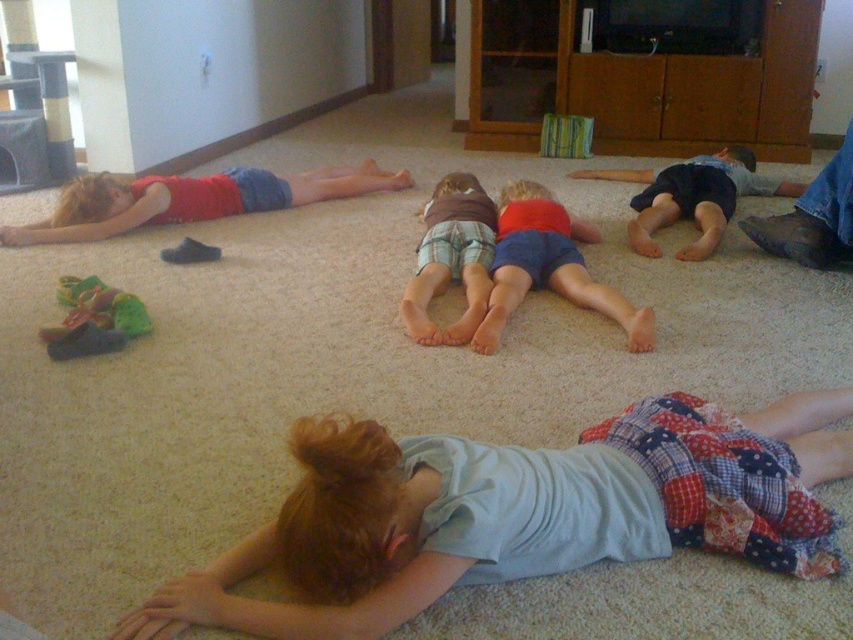
Question: Which object is positioned closest to the rubberized green and brown toy at lower left?

Choices:
 (A) brown plaid shorts at center
 (B) matte red shirt at left
 (C) light blue fabric at center

Answer: (A)

Question: Which point appears closest to the camera in this image?

Choices:
 (A) (125, 310)
 (B) (413, 289)
 (C) (521, 531)

Answer: (C)

Question: Considering the relative positions of brown plaid shorts at center and dark blue shorts at right in the image provided, where is brown plaid shorts at center located with respect to dark blue shorts at right?

Choices:
 (A) below
 (B) above

Answer: (A)

Question: Does matte red shirt at left have a lesser width compared to rubberized green and brown toy at lower left?

Choices:
 (A) no
 (B) yes

Answer: (A)

Question: Does light blue fabric at center have a larger size compared to red cotton shorts at center?

Choices:
 (A) no
 (B) yes

Answer: (B)

Question: Which of the following is the closest to the observer?

Choices:
 (A) (730, 435)
 (B) (90, 326)
 (C) (480, 282)

Answer: (A)